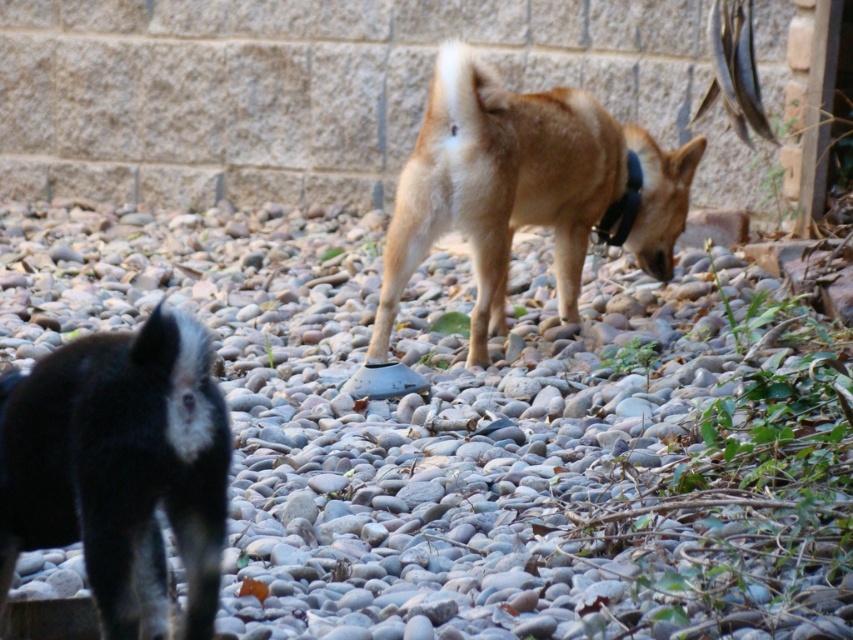
Question: Is gray pebbles at center below light brown fur at center?

Choices:
 (A) yes
 (B) no

Answer: (A)

Question: Is the position of light brown fur at center more distant than that of black fabric neckband at center?

Choices:
 (A) no
 (B) yes

Answer: (A)

Question: Among these points, which one is farthest from the camera?

Choices:
 (A) coord(624,205)
 (B) coord(706,419)
 (C) coord(421,141)
 (D) coord(129,348)

Answer: (A)

Question: Among these objects, which one is nearest to the camera?

Choices:
 (A) gray pebbles at center
 (B) black fur dog at left

Answer: (B)

Question: Is gray pebbles at center wider than light brown fur at center?

Choices:
 (A) yes
 (B) no

Answer: (B)

Question: Which object is farther from the camera taking this photo?

Choices:
 (A) gray pebbles at center
 (B) black fur dog at left

Answer: (A)